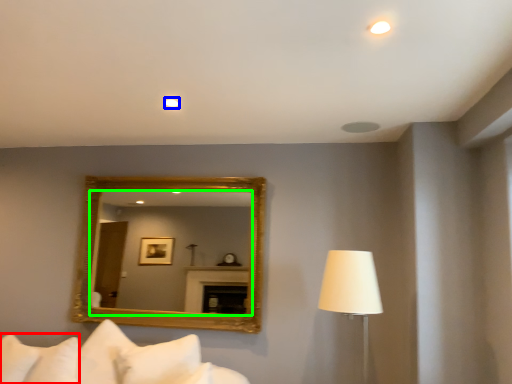
Question: Which is farther away from pillow (highlighted by a red box)? lighting (highlighted by a blue box) or mirror (highlighted by a green box)?

Choices:
 (A) lighting
 (B) mirror

Answer: (B)